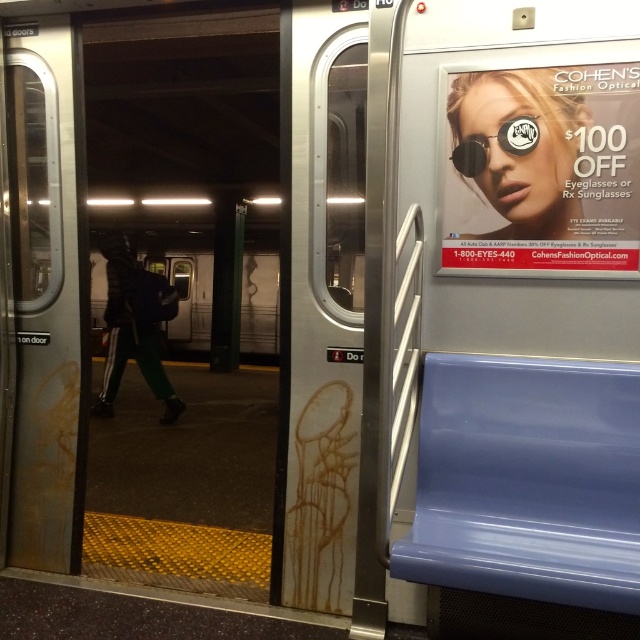
Is metallic silver door at center to the left of sunglasses at upper right from the viewer's perspective?

Yes, metallic silver door at center is to the left of sunglasses at upper right.

Is point (145, 51) positioned in front of point (525, 122)?

That is False.

Between point (246, 26) and point (525, 129), which one is positioned behind?

Point (246, 26)

Find the location of a particular element. Image resolution: width=640 pixels, height=640 pixels. metallic silver door at center is located at coordinates (186, 298).

Which of these two, metallic silver door at center or green fabric pants at left, stands taller?

metallic silver door at center

Does metallic silver door at center have a greater width compared to green fabric pants at left?

Yes.

You are a GUI agent. You are given a task and a screenshot of the screen. Output one action in this format:
    pyautogui.click(x=<x>, y=<y>)
    Task: Click on the metallic silver door at center
    This screenshot has height=640, width=640.
    Given the screenshot: What is the action you would take?
    pyautogui.click(x=186, y=298)

Is metallic silver door at center above matte plastic sign at upper right?

No.

Does metallic silver door at center have a smaller size compared to matte plastic sign at upper right?

No, metallic silver door at center is not smaller than matte plastic sign at upper right.

Does point (138, 97) lie in front of point (508, 188)?

No, it is not.

The image size is (640, 640). I want to click on metallic silver door at center, so click(x=186, y=298).